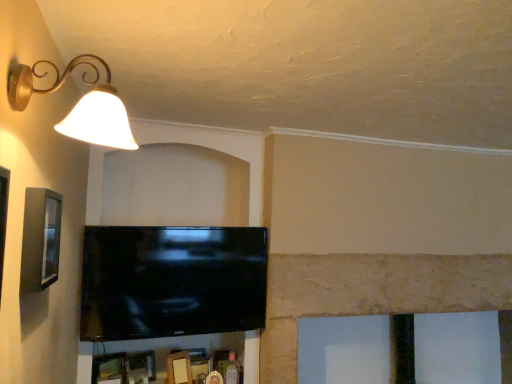
Question: Is point (29, 253) positioned closer to the camera than point (96, 87)?

Choices:
 (A) farther
 (B) closer

Answer: (B)

Question: Looking at the image, does matte gray picture frame at left seem bigger or smaller compared to matte gold lampshade at upper left?

Choices:
 (A) small
 (B) big

Answer: (A)

Question: Which of these objects is positioned farthest from the matte gold lampshade at upper left?

Choices:
 (A) black glossy tv at center
 (B) matte gray picture frame at left

Answer: (A)

Question: Considering the real-world distances, which object is closest to the black glossy tv at center?

Choices:
 (A) matte gold lampshade at upper left
 (B) matte gray picture frame at left

Answer: (B)